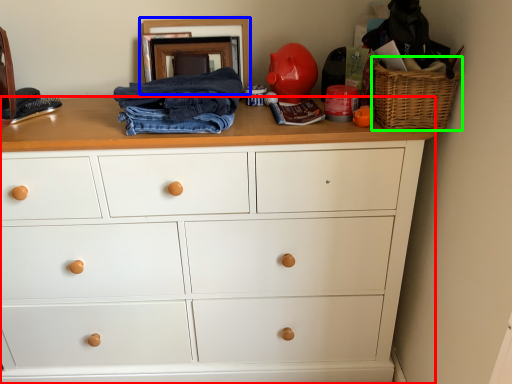
Question: Based on their relative distances, which object is nearer to chest of drawers (highlighted by a red box)? Choose from picture frame (highlighted by a blue box) and basket (highlighted by a green box).

Choices:
 (A) picture frame
 (B) basket

Answer: (B)